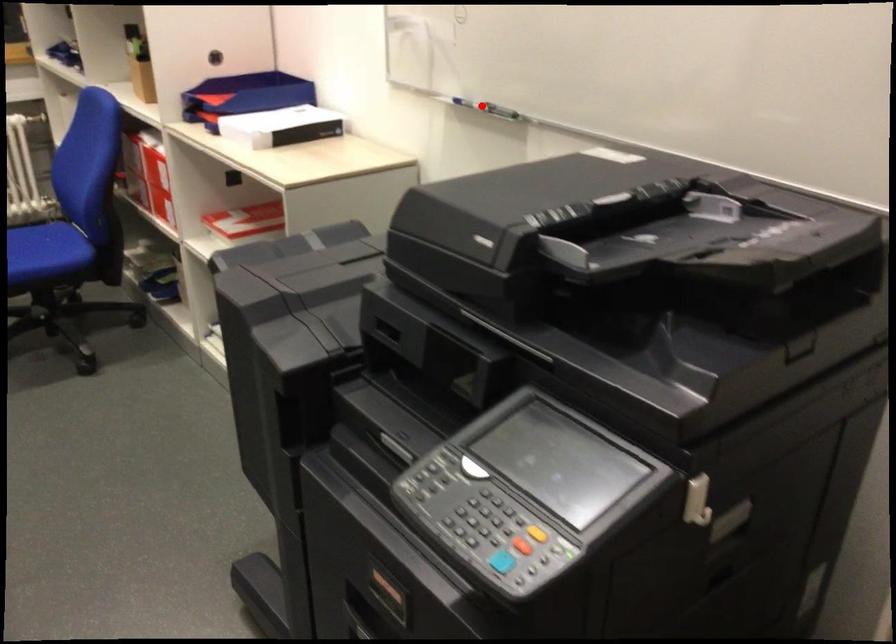
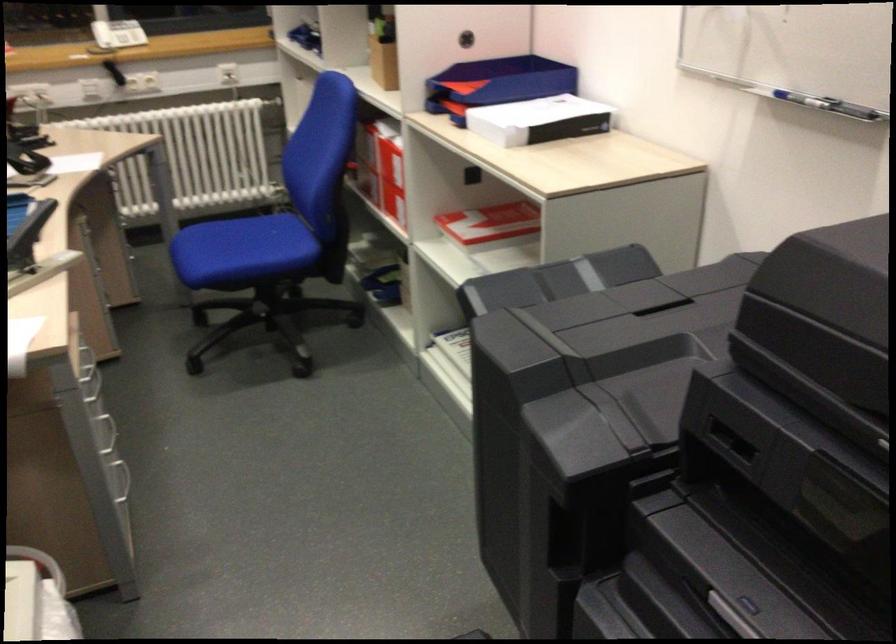
Question: I am providing you with two images of the same scene from different viewpoints. A red point is shown in image1. For the corresponding object point in image2, is it positioned nearer or farther from the camera?

Choices:
 (A) Nearer
 (B) Farther

Answer: (A)